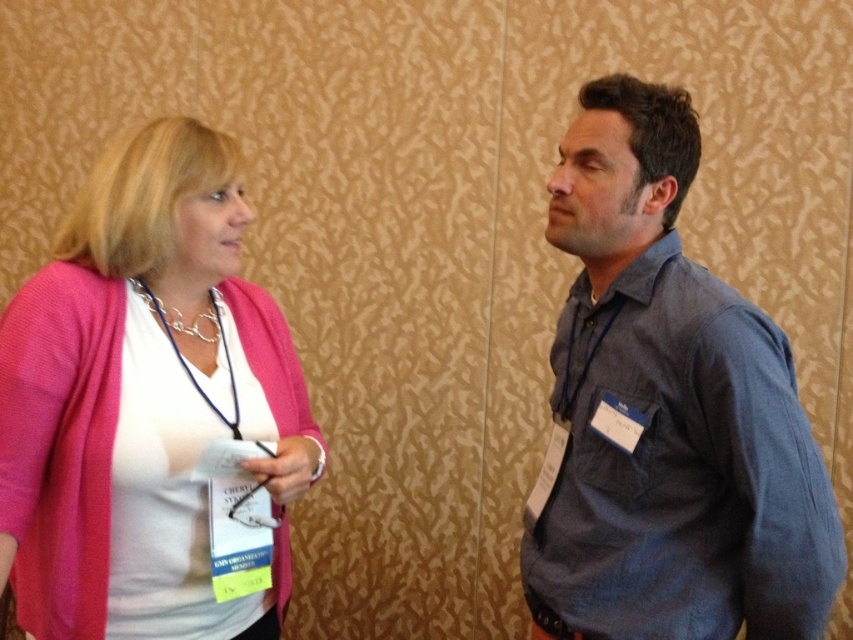
The height and width of the screenshot is (640, 853). What do you see at coordinates (666, 413) in the screenshot?
I see `blue denim shirt at right` at bounding box center [666, 413].

What do you see at coordinates (666, 413) in the screenshot?
I see `blue denim shirt at right` at bounding box center [666, 413].

Image resolution: width=853 pixels, height=640 pixels. Identify the location of blue denim shirt at right. (666, 413).